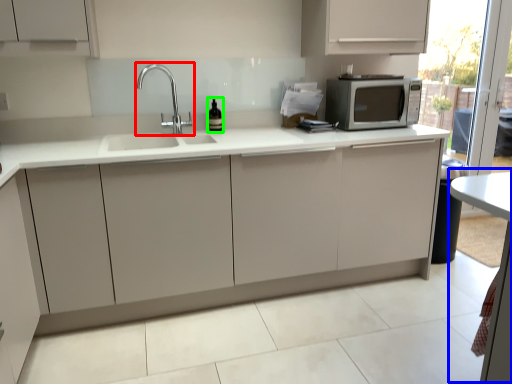
Question: Estimate the real-world distances between objects in this image. Which object is closer to tap (highlighted by a red box), table (highlighted by a blue box) or wine bottle (highlighted by a green box)?

Choices:
 (A) table
 (B) wine bottle

Answer: (B)